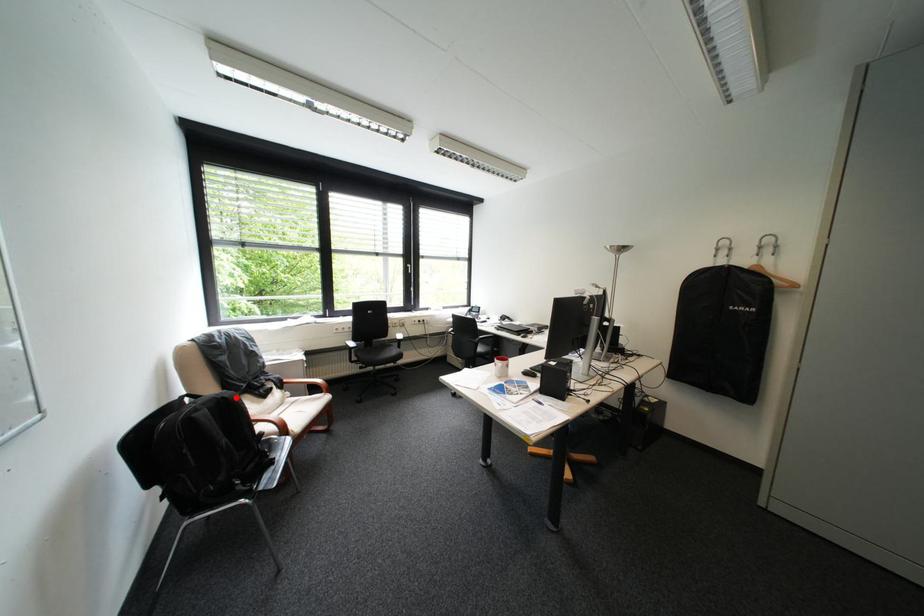
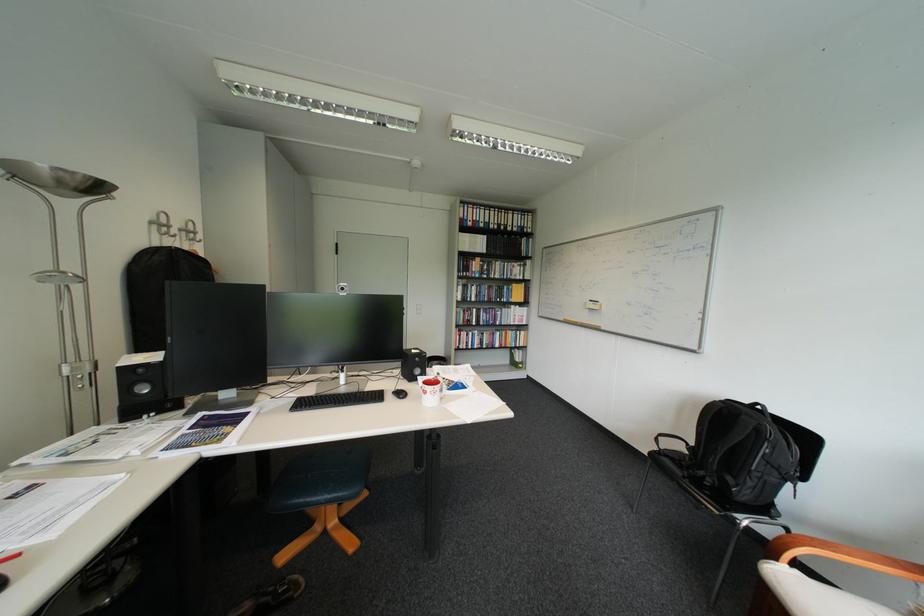
Locate, in the second image, the point that corresponds to the highlighted location in the first image.

(756, 418)